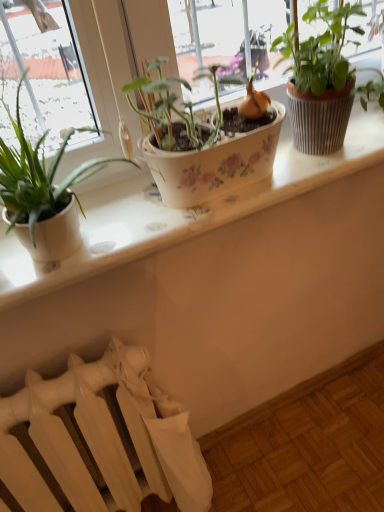
Locate an element on the screen. Image resolution: width=384 pixels, height=512 pixels. free spot above white ceramic window sill at center (from a real-world perspective) is located at coordinates 209,195.